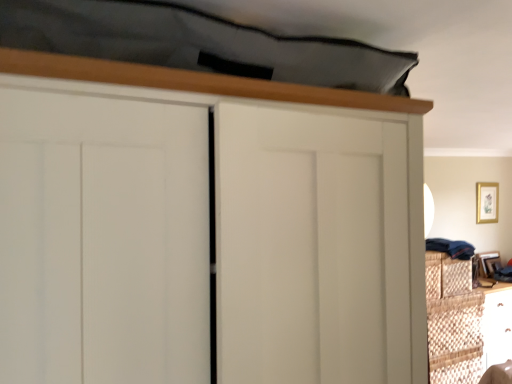
What are the coordinates of `woven bamboo vanity at lower right` in the screenshot? It's located at (464, 321).

This screenshot has height=384, width=512. What do you see at coordinates (464, 321) in the screenshot? I see `woven bamboo vanity at lower right` at bounding box center [464, 321].

What is the approximate width of woven bamboo vanity at lower right?

woven bamboo vanity at lower right is 18.69 inches in width.

Image resolution: width=512 pixels, height=384 pixels. Find the location of `woven bamboo vanity at lower right`. woven bamboo vanity at lower right is located at coordinates (464, 321).